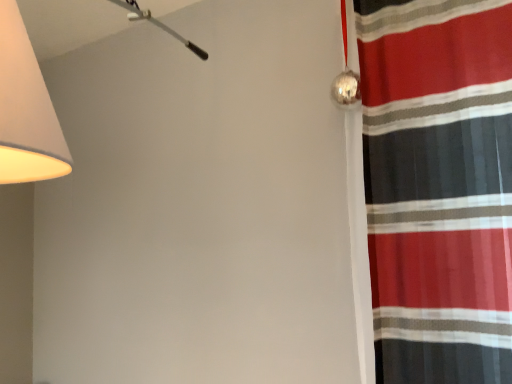
Question: Considering the relative sizes of striped fabric curtain at right and matte white lampshade at upper left in the image provided, is striped fabric curtain at right taller than matte white lampshade at upper left?

Choices:
 (A) yes
 (B) no

Answer: (A)

Question: Does striped fabric curtain at right appear on the left side of matte white lampshade at upper left?

Choices:
 (A) no
 (B) yes

Answer: (A)

Question: Does striped fabric curtain at right turn towards matte white lampshade at upper left?

Choices:
 (A) no
 (B) yes

Answer: (B)

Question: Can matte white lampshade at upper left be found inside striped fabric curtain at right?

Choices:
 (A) yes
 (B) no

Answer: (B)

Question: Considering the relative sizes of striped fabric curtain at right and matte white lampshade at upper left in the image provided, is striped fabric curtain at right wider than matte white lampshade at upper left?

Choices:
 (A) yes
 (B) no

Answer: (B)

Question: Does striped fabric curtain at right come behind matte white lampshade at upper left?

Choices:
 (A) no
 (B) yes

Answer: (B)

Question: Is matte white lampshade at upper left oriented away from striped fabric curtain at right?

Choices:
 (A) no
 (B) yes

Answer: (A)

Question: Could you tell me if matte white lampshade at upper left is facing striped fabric curtain at right?

Choices:
 (A) yes
 (B) no

Answer: (B)

Question: Does matte white lampshade at upper left appear on the left side of striped fabric curtain at right?

Choices:
 (A) no
 (B) yes

Answer: (B)

Question: Does matte white lampshade at upper left have a lesser width compared to striped fabric curtain at right?

Choices:
 (A) yes
 (B) no

Answer: (B)

Question: Does matte white lampshade at upper left have a larger size compared to striped fabric curtain at right?

Choices:
 (A) no
 (B) yes

Answer: (B)

Question: From the image's perspective, would you say matte white lampshade at upper left is positioned over striped fabric curtain at right?

Choices:
 (A) no
 (B) yes

Answer: (B)

Question: Which is correct: matte white lampshade at upper left is inside striped fabric curtain at right, or outside of it?

Choices:
 (A) outside
 (B) inside

Answer: (A)